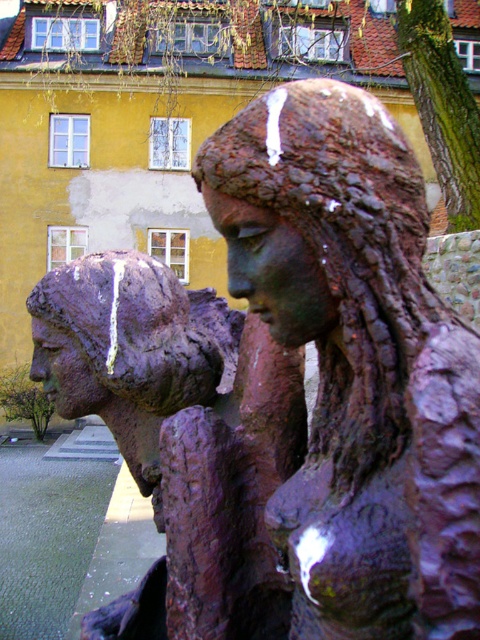
Is rusty bronze statue at center to the right of rusty bronze statue at left from the viewer's perspective?

Indeed, rusty bronze statue at center is positioned on the right side of rusty bronze statue at left.

Measure the distance between rusty bronze statue at center and camera.

The distance of rusty bronze statue at center from camera is 1.11 meters.

The image size is (480, 640). Find the location of `rusty bronze statue at center`. rusty bronze statue at center is located at coordinates (357, 362).